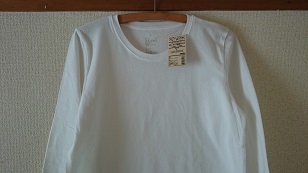
Find the location of a particular element. The height and width of the screenshot is (173, 308). hanger is located at coordinates (155, 15).